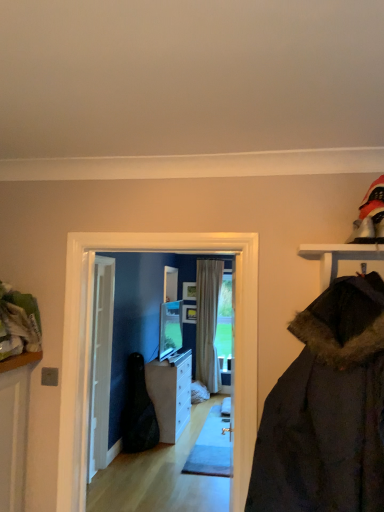
Question: Considering the relative positions of beige fabric curtain at center and matte glass screen door at center in the image provided, is beige fabric curtain at center to the left or to the right of matte glass screen door at center?

Choices:
 (A) right
 (B) left

Answer: (A)

Question: Considering their positions, is beige fabric curtain at center located in front of or behind matte glass screen door at center?

Choices:
 (A) front
 (B) behind

Answer: (B)

Question: Which is farther from the beige fabric curtain at center?

Choices:
 (A) black leather guitar case at center
 (B) white glossy cabinet at center
 (C) matte glass screen door at center
 (D) white wooden door at center

Answer: (C)

Question: Based on their relative distances, which object is nearer to the beige fabric curtain at center?

Choices:
 (A) black leather guitar case at center
 (B) white glossy cabinet at center
 (C) white wooden door at center
 (D) matte glass screen door at center

Answer: (B)